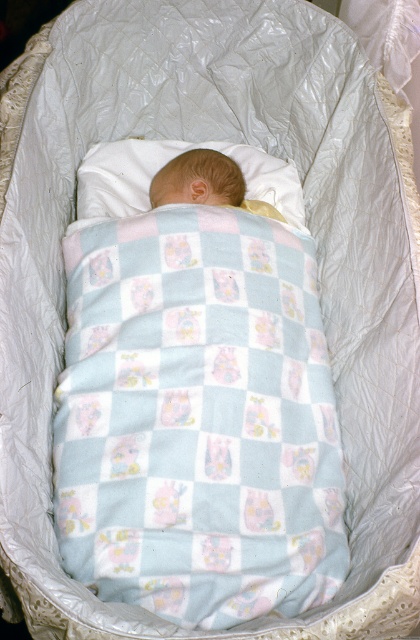
Question: Does light blue flannel blanket at center have a smaller size compared to light blue soft fabric newborn at center?

Choices:
 (A) no
 (B) yes

Answer: (A)

Question: Does light blue flannel blanket at center appear on the right side of white soft pillow at center?

Choices:
 (A) no
 (B) yes

Answer: (B)

Question: Based on their relative distances, which object is nearer to the light blue flannel blanket at center?

Choices:
 (A) light blue soft fabric newborn at center
 (B) white soft pillow at center

Answer: (B)

Question: Among these objects, which one is farthest from the camera?

Choices:
 (A) light blue flannel blanket at center
 (B) light blue soft fabric newborn at center

Answer: (B)

Question: Which of the following is the closest to the observer?

Choices:
 (A) light blue soft fabric newborn at center
 (B) white soft pillow at center
 (C) light blue flannel blanket at center

Answer: (C)

Question: Is light blue flannel blanket at center positioned before white soft pillow at center?

Choices:
 (A) no
 (B) yes

Answer: (B)